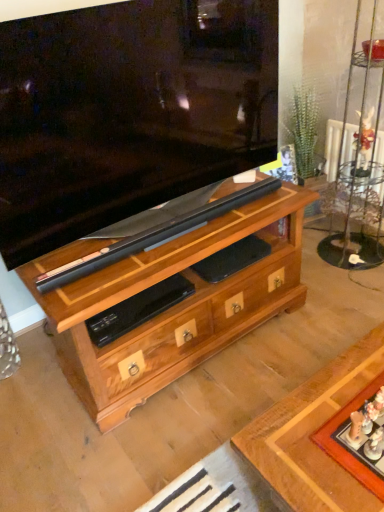
I want to click on vacant point above wooden chest of drawers at center (from a real-world perspective), so (228, 365).